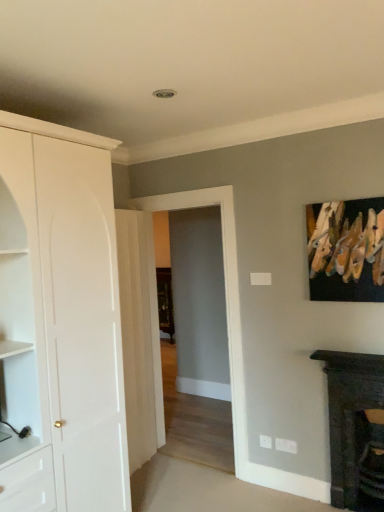
What do you see at coordinates (351, 420) in the screenshot? The image size is (384, 512). I see `dark wood fireplace at lower right` at bounding box center [351, 420].

The image size is (384, 512). What do you see at coordinates (140, 335) in the screenshot?
I see `white glossy door at center` at bounding box center [140, 335].

This screenshot has width=384, height=512. Find the location of `white matte cabinet at left`. white matte cabinet at left is located at coordinates (59, 322).

Do you think transparent glass door at center is within dark wood fireplace at lower right, or outside of it?

The correct answer is: outside.

Is point (214, 196) behind point (378, 362)?

That is True.

Consider the image. What's the angular difference between transparent glass door at center and dark wood fireplace at lower right's facing directions?

There is a 0.000931-degree angle between the facing directions of transparent glass door at center and dark wood fireplace at lower right.

From the image's perspective, which is above, transparent glass door at center or dark wood fireplace at lower right?

From the image's view, transparent glass door at center is above.

Considering the relative sizes of wooden clothespins at upper right and transparent glass door at center in the image provided, is wooden clothespins at upper right bigger than transparent glass door at center?

No, wooden clothespins at upper right is not bigger than transparent glass door at center.

Is wooden clothespins at upper right next to transparent glass door at center and touching it?

wooden clothespins at upper right is not next to transparent glass door at center, and they're not touching.

Is wooden clothespins at upper right turned away from transparent glass door at center?

No.

How different are the orientations of wooden clothespins at upper right and transparent glass door at center in degrees?

The angular difference between wooden clothespins at upper right and transparent glass door at center is 0.00323 degrees.

Does white glossy door at center lie behind white matte cabinet at left?

Yes, it is behind white matte cabinet at left.

Considering the sizes of white glossy door at center and white matte cabinet at left in the image, is white glossy door at center taller or shorter than white matte cabinet at left?

white glossy door at center is shorter than white matte cabinet at left.

Is white glossy door at center positioned far away from white matte cabinet at left?

No, white glossy door at center is in close proximity to white matte cabinet at left.

Is white glossy door at center wider or thinner than white matte cabinet at left?

Considering their sizes, white glossy door at center looks slimmer than white matte cabinet at left.

Considering the sizes of objects wooden clothespins at upper right and white matte cabinet at left in the image provided, who is thinner, wooden clothespins at upper right or white matte cabinet at left?

wooden clothespins at upper right.

From a real-world perspective, does wooden clothespins at upper right stand above white matte cabinet at left?

Indeed, from a real-world perspective, wooden clothespins at upper right stands above white matte cabinet at left.

From the image's perspective, relative to white matte cabinet at left, is wooden clothespins at upper right above or below?

wooden clothespins at upper right is above white matte cabinet at left.

Is wooden clothespins at upper right in contact with white matte cabinet at left?

No, wooden clothespins at upper right is not in contact with white matte cabinet at left.

Between point (155, 395) and point (148, 275), which one is positioned behind?

The point (155, 395) is behind.

Can you confirm if white glossy door at center is bigger than transparent glass door at center?

No, white glossy door at center is not bigger than transparent glass door at center.

Measure the distance from white glossy door at center to transparent glass door at center.

white glossy door at center is 5.36 inches from transparent glass door at center.

Is point (131, 402) more distant than point (82, 189)?

Yes.

Is transparent glass door at center oriented towards white matte cabinet at left?

Yes, transparent glass door at center faces towards white matte cabinet at left.

Who is bigger, transparent glass door at center or white matte cabinet at left?

white matte cabinet at left.

Is white matte cabinet at left facing away from dark wood fireplace at lower right?

No, dark wood fireplace at lower right is not at the back of white matte cabinet at left.

There is a dark wood fireplace at lower right. Where is `cabinetry above it (from a real-world perspective)`? Image resolution: width=384 pixels, height=512 pixels. cabinetry above it (from a real-world perspective) is located at coordinates (59, 322).

Can you confirm if white matte cabinet at left is smaller than dark wood fireplace at lower right?

No, white matte cabinet at left is not smaller than dark wood fireplace at lower right.

From the image's perspective, relative to dark wood fireplace at lower right, is white matte cabinet at left above or below?

Based on their image positions, white matte cabinet at left is located above dark wood fireplace at lower right.

I want to click on glass door positioned vertically above the dark wood fireplace at lower right (from a real-world perspective), so click(157, 313).

What are the coordinates of `picture frame on the right of the transparent glass door at center` in the screenshot? It's located at (346, 250).

Looking at the image, which one is located further to white matte cabinet at left, white glossy door at center or wooden clothespins at upper right?

Based on the image, wooden clothespins at upper right appears to be further to white matte cabinet at left.

In the scene shown: Looking at the image, which one is located closer to wooden clothespins at upper right, white matte cabinet at left or transparent glass door at center?

Among the two, transparent glass door at center is located nearer to wooden clothespins at upper right.

Looking at the image, which one is located closer to dark wood fireplace at lower right, transparent glass door at center or white matte cabinet at left?

Based on the image, transparent glass door at center appears to be nearer to dark wood fireplace at lower right.

Which object lies further to the anchor point white glossy door at center, transparent glass door at center or wooden clothespins at upper right?

wooden clothespins at upper right is further to white glossy door at center.

Which object lies further to the anchor point dark wood fireplace at lower right, transparent glass door at center or white glossy door at center?

The object further to dark wood fireplace at lower right is white glossy door at center.

From the image, which object appears to be nearer to transparent glass door at center, white matte cabinet at left or wooden clothespins at upper right?

Based on the image, wooden clothespins at upper right appears to be nearer to transparent glass door at center.

When comparing their distances from white matte cabinet at left, does wooden clothespins at upper right or dark wood fireplace at lower right seem closer?

Among the two, wooden clothespins at upper right is located nearer to white matte cabinet at left.

Looking at the image, which one is located further to transparent glass door at center, dark wood fireplace at lower right or white matte cabinet at left?

Among the two, white matte cabinet at left is located further to transparent glass door at center.

Identify the location of glass door situated between white matte cabinet at left and wooden clothespins at upper right from left to right. The image size is (384, 512). (157, 313).

Find the location of a particular element. door situated between white matte cabinet at left and wooden clothespins at upper right from left to right is located at coordinates (140, 335).

Locate an element on the screen. This screenshot has height=512, width=384. glass door between white matte cabinet at left and white glossy door at center in the front-back direction is located at coordinates (157, 313).

In order to click on picture frame between white matte cabinet at left and dark wood fireplace at lower right from left to right in this screenshot , I will do `click(346, 250)`.